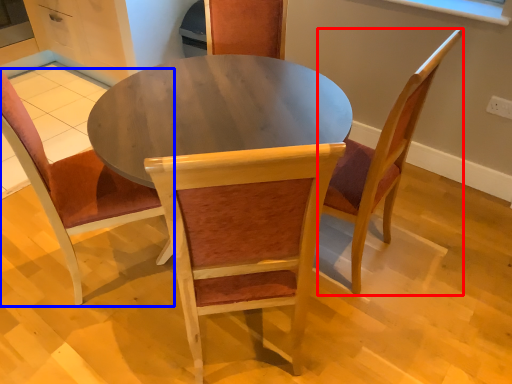
Question: Which of the following is the farthest to the observer, chair (highlighted by a red box) or chair (highlighted by a blue box)?

Choices:
 (A) chair
 (B) chair

Answer: (A)